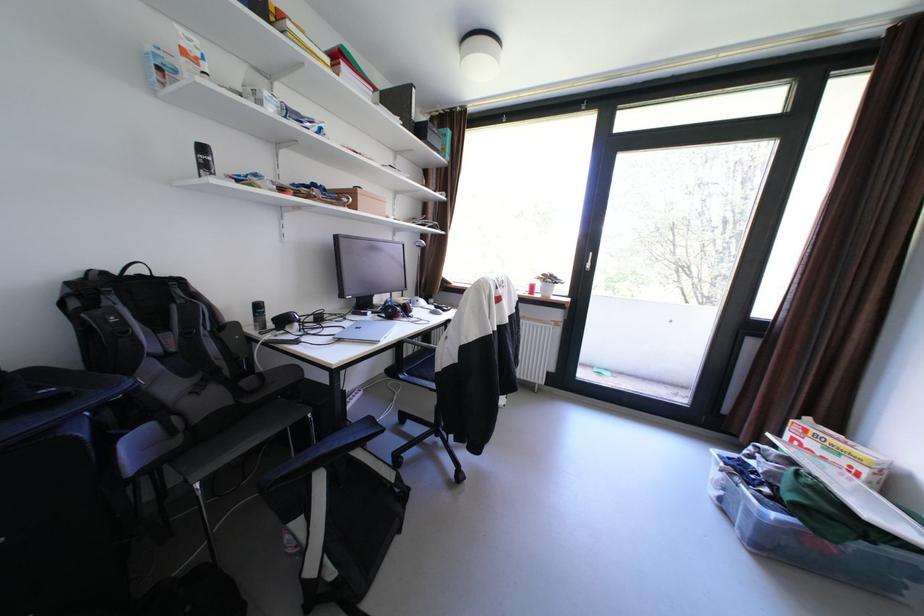
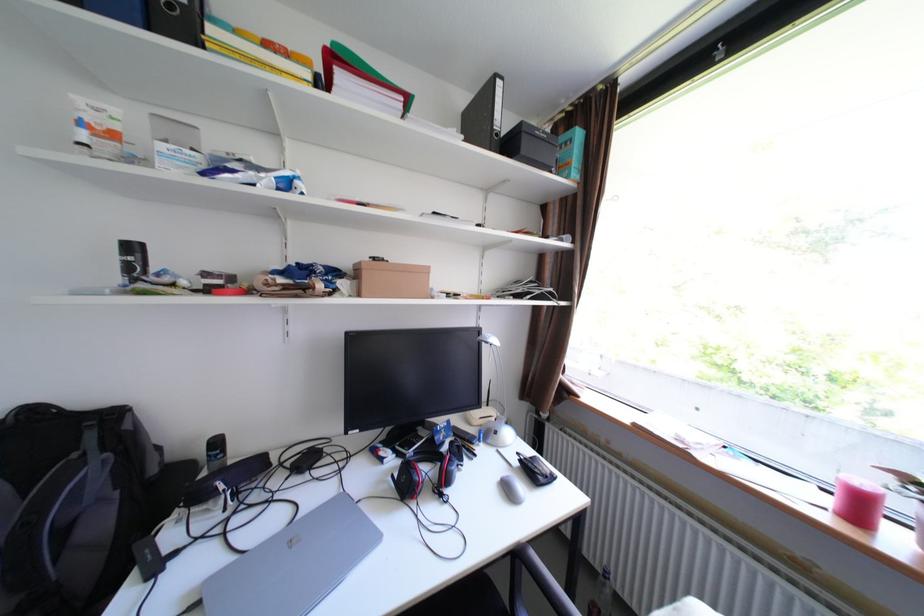
Where in the second image is the point corresponding to point (370, 197) from the first image?

(375, 275)